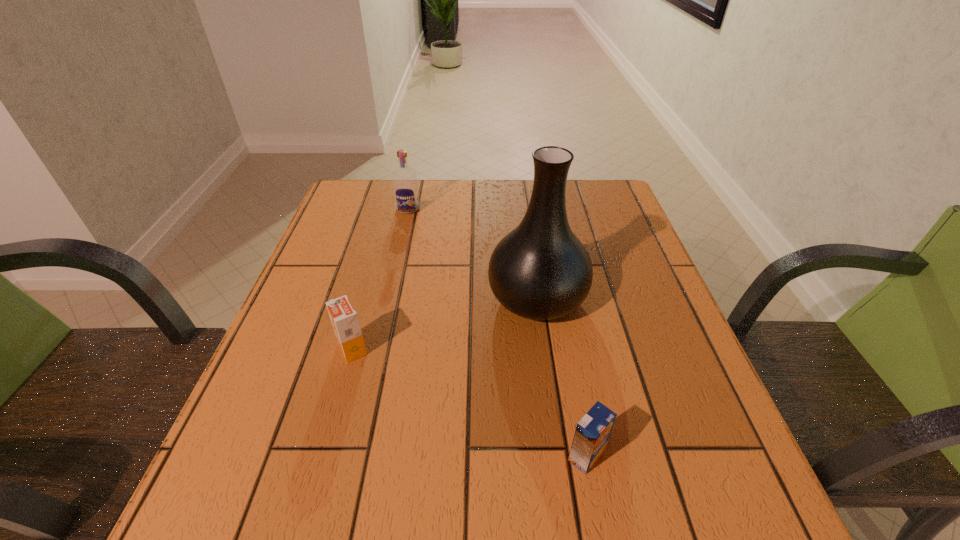
Where is `vacant region located 0.170m on the right of the farther orange_juice`? The height and width of the screenshot is (540, 960). vacant region located 0.170m on the right of the farther orange_juice is located at coordinates (456, 349).

Locate an element on the screen. free region located on the front of the nearest object is located at coordinates (598, 516).

The width and height of the screenshot is (960, 540). What are the coordinates of `object that is at the far edge` in the screenshot? It's located at (404, 179).

Where is `object that is at the left edge`? Image resolution: width=960 pixels, height=540 pixels. object that is at the left edge is located at coordinates (344, 319).

Find the location of a particular element. This screenshot has height=540, width=960. vacant space at the far edge of the desktop is located at coordinates (529, 195).

Where is `vacant space at the left edge of the desktop`? Image resolution: width=960 pixels, height=540 pixels. vacant space at the left edge of the desktop is located at coordinates (251, 424).

At what (x,y) coordinates should I click in order to perform the action: click on vacant position at the right edge of the desktop. Please return your answer as a coordinate pair (x, y). Looking at the image, I should click on tap(604, 279).

Identify the location of blank space at the far left corner of the desktop. 342,198.

Locate an element on the screen. free location at the near left corner is located at coordinates (215, 524).

Locate an element on the screen. free spot at the far right corner of the desktop is located at coordinates (569, 213).